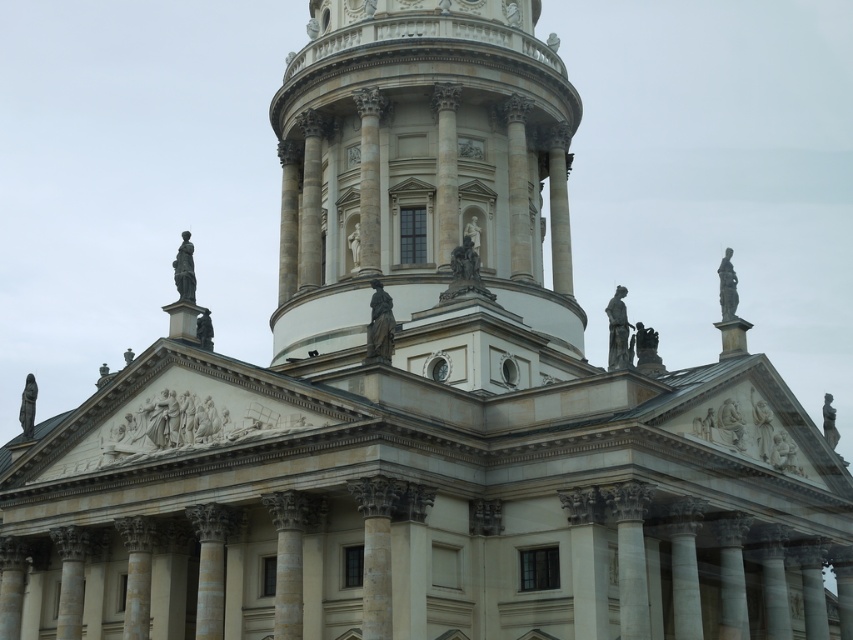
From the picture: Is polished bronze statue at center shorter than gray stone statue at upper right?

Yes, polished bronze statue at center is shorter than gray stone statue at upper right.

From the picture: Is polished bronze statue at center bigger than gray stone statue at upper right?

No.

Identify the location of polished bronze statue at center. The height and width of the screenshot is (640, 853). (465, 262).

The image size is (853, 640). I want to click on polished bronze statue at center, so (465, 262).

Based on the photo, can you confirm if matte stone statue at center is positioned to the left of polished bronze statue at center?

Correct, you'll find matte stone statue at center to the left of polished bronze statue at center.

Does matte stone statue at center have a lesser width compared to polished bronze statue at center?

Yes, matte stone statue at center is thinner than polished bronze statue at center.

Find the location of a particular element. This screenshot has height=640, width=853. matte stone statue at center is located at coordinates (379, 324).

In order to click on matte stone statue at center in this screenshot , I will do `click(379, 324)`.

Is gray stone statue at upper right behind polished stone statue at center?

That is False.

Who is shorter, gray stone statue at upper right or polished stone statue at center?

With less height is polished stone statue at center.

Does point (727, 305) lie behind point (357, 228)?

That is False.

Image resolution: width=853 pixels, height=640 pixels. What are the coordinates of `gray stone statue at upper right` in the screenshot? It's located at (727, 285).